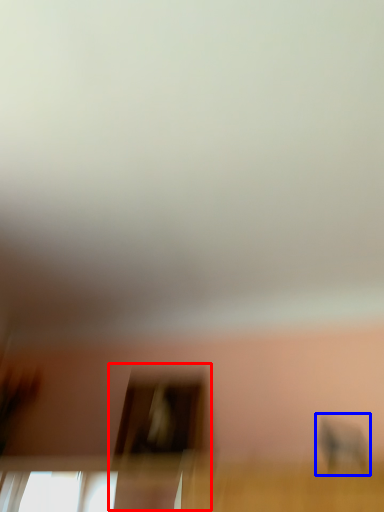
Question: Which point is further to the camera, screen door (highlighted by a red box) or baby elephant (highlighted by a blue box)?

Choices:
 (A) screen door
 (B) baby elephant

Answer: (A)